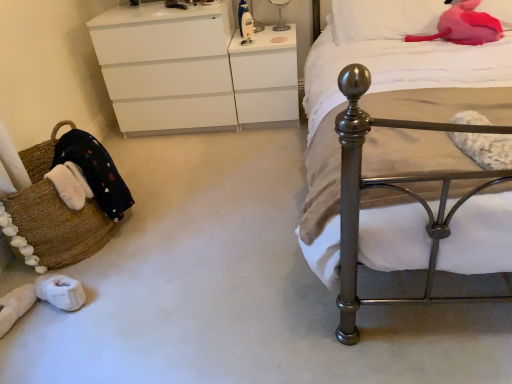
At what (x,y) coordinates should I click in order to perform the action: click on free location to the right of brown woven basket at lower left. Please return your answer as a coordinate pair (x, y). The width and height of the screenshot is (512, 384). Looking at the image, I should click on (x=180, y=223).